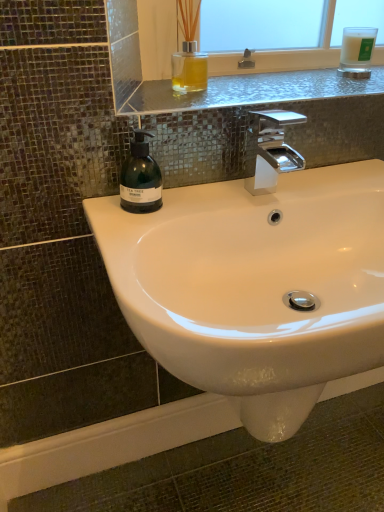
Question: Is white glossy sink at center looking in the opposite direction of metallic glass shelf at upper center?

Choices:
 (A) yes
 (B) no

Answer: (B)

Question: Considering the relative positions of white glossy sink at center and metallic glass shelf at upper center in the image provided, is white glossy sink at center behind metallic glass shelf at upper center?

Choices:
 (A) yes
 (B) no

Answer: (B)

Question: From a real-world perspective, is white glossy sink at center on top of metallic glass shelf at upper center?

Choices:
 (A) no
 (B) yes

Answer: (A)

Question: Is white glossy sink at center next to metallic glass shelf at upper center?

Choices:
 (A) no
 (B) yes

Answer: (A)

Question: Considering the relative sizes of white glossy sink at center and metallic glass shelf at upper center in the image provided, is white glossy sink at center thinner than metallic glass shelf at upper center?

Choices:
 (A) no
 (B) yes

Answer: (A)

Question: From the image's perspective, does white glossy sink at center appear lower than metallic glass shelf at upper center?

Choices:
 (A) no
 (B) yes

Answer: (B)

Question: Is white glossy sink at center aimed at green matte soap dispenser at left?

Choices:
 (A) yes
 (B) no

Answer: (B)

Question: From the image's perspective, is white glossy sink at center below green matte soap dispenser at left?

Choices:
 (A) no
 (B) yes

Answer: (B)

Question: Does white glossy sink at center have a larger size compared to green matte soap dispenser at left?

Choices:
 (A) no
 (B) yes

Answer: (B)

Question: Considering the relative sizes of white glossy sink at center and green matte soap dispenser at left in the image provided, is white glossy sink at center thinner than green matte soap dispenser at left?

Choices:
 (A) yes
 (B) no

Answer: (B)

Question: Is green matte soap dispenser at left a part of white glossy sink at center?

Choices:
 (A) no
 (B) yes

Answer: (A)

Question: Does white glossy sink at center come behind green matte soap dispenser at left?

Choices:
 (A) no
 (B) yes

Answer: (A)

Question: Is white frosted glass candle at upper right wider than green matte soap dispenser at left?

Choices:
 (A) yes
 (B) no

Answer: (A)